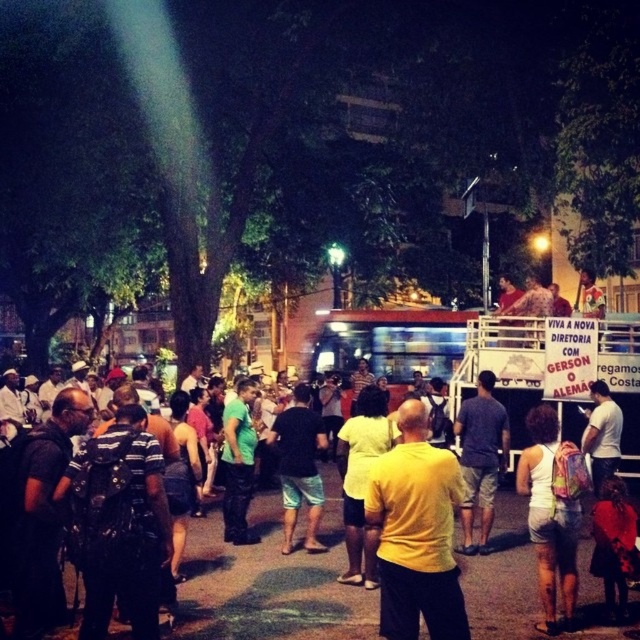
Does dark blue jeans at center lie behind white cotton tank top at center-right?

Yes, it is behind white cotton tank top at center-right.

Is dark blue jeans at center shorter than white cotton tank top at center-right?

Yes.

Where is `dark blue jeans at center`? The width and height of the screenshot is (640, 640). dark blue jeans at center is located at coordinates (269, 580).